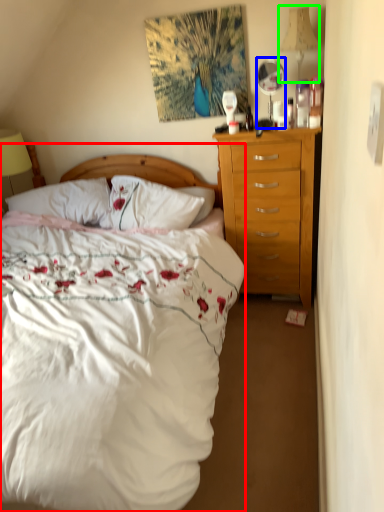
Question: Considering the real-world distances, which object is farthest from bed (highlighted by a red box)? mirror (highlighted by a blue box) or lamp (highlighted by a green box)?

Choices:
 (A) mirror
 (B) lamp

Answer: (B)